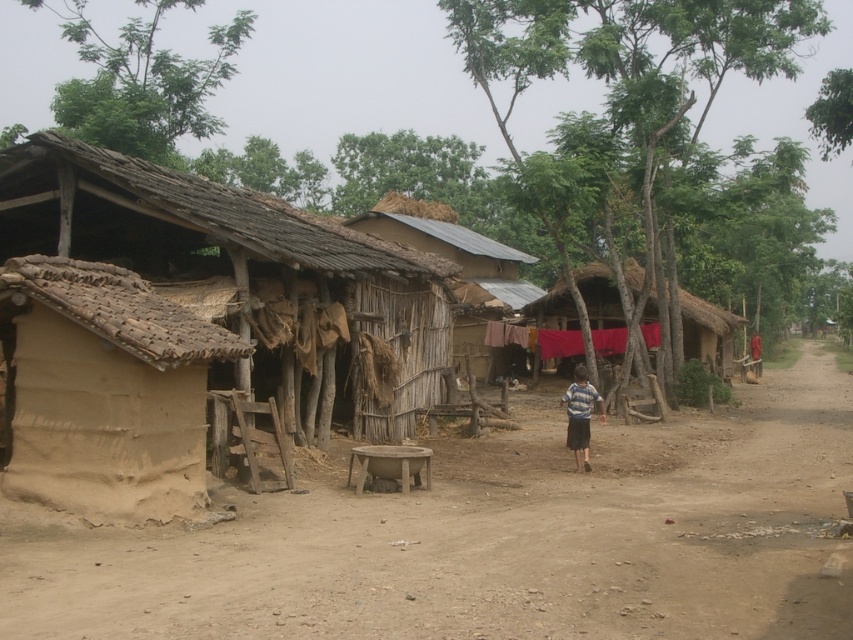
Question: Observing the image, what is the correct spatial positioning of brown dirt field at center in reference to striped fabric shirt at center?

Choices:
 (A) right
 (B) left

Answer: (A)

Question: Estimate the real-world distances between objects in this image. Which object is closer to the thatched straw hut at center?

Choices:
 (A) brown dirt field at center
 (B) brown mud hut at left
 (C) thatched wood hut at center

Answer: (C)

Question: Which object is closer to the camera taking this photo?

Choices:
 (A) brown mud hut at left
 (B) thatched straw hut at center
 (C) brown dirt field at center

Answer: (C)

Question: Based on their relative distances, which object is farther from the thatched wood hut at center?

Choices:
 (A) striped fabric shirt at center
 (B) brown wooden stool at center
 (C) brown mud hut at left
 (D) thatched straw hut at center

Answer: (B)

Question: Considering the relative positions of thatched wood hut at center and striped fabric shirt at center in the image provided, where is thatched wood hut at center located with respect to striped fabric shirt at center?

Choices:
 (A) below
 (B) above

Answer: (B)

Question: Can you confirm if brown dirt field at center is positioned below thatched wood hut at center?

Choices:
 (A) no
 (B) yes

Answer: (B)